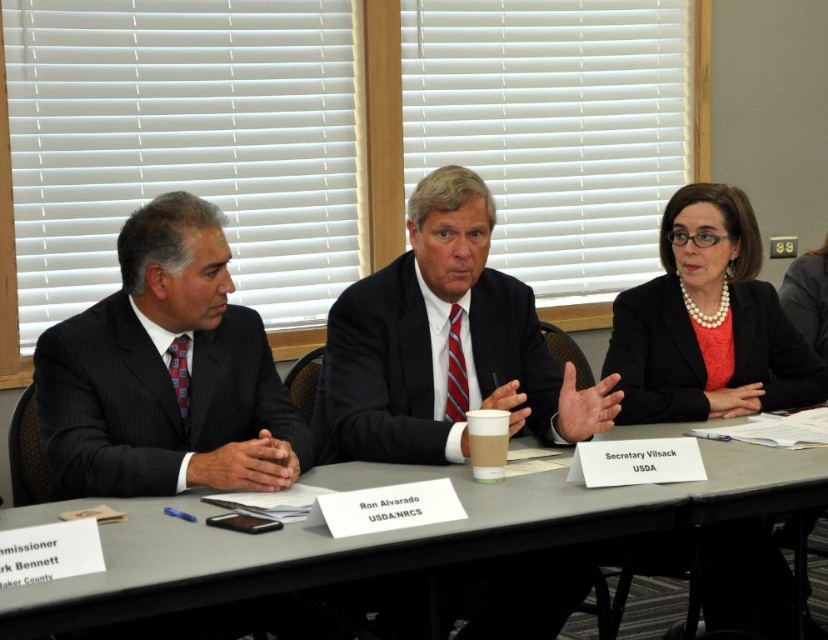
Which is behind, point (143, 304) or point (420, 344)?

The point (420, 344) is more distant.

Which of these two, pinstriped suit at left or matte black suit at center, stands shorter?

With less height is matte black suit at center.

Where is `pinstriped suit at left`? pinstriped suit at left is located at coordinates (166, 372).

Is point (773, 490) positioned behind point (368, 298)?

That is False.

The width and height of the screenshot is (828, 640). Describe the element at coordinates (383, 534) in the screenshot. I see `gray plastic table at center` at that location.

Between point (23, 524) and point (412, 289), which one is positioned in front?

Point (23, 524) is in front.

Find the location of a particular element. This screenshot has width=828, height=640. gray plastic table at center is located at coordinates (383, 534).

Between black suit at center and gray plastic table at center, which one appears on the left side from the viewer's perspective?

gray plastic table at center

Is black suit at center taller than gray plastic table at center?

Indeed, black suit at center has a greater height compared to gray plastic table at center.

Locate an element on the screen. Image resolution: width=828 pixels, height=640 pixels. black suit at center is located at coordinates (444, 346).